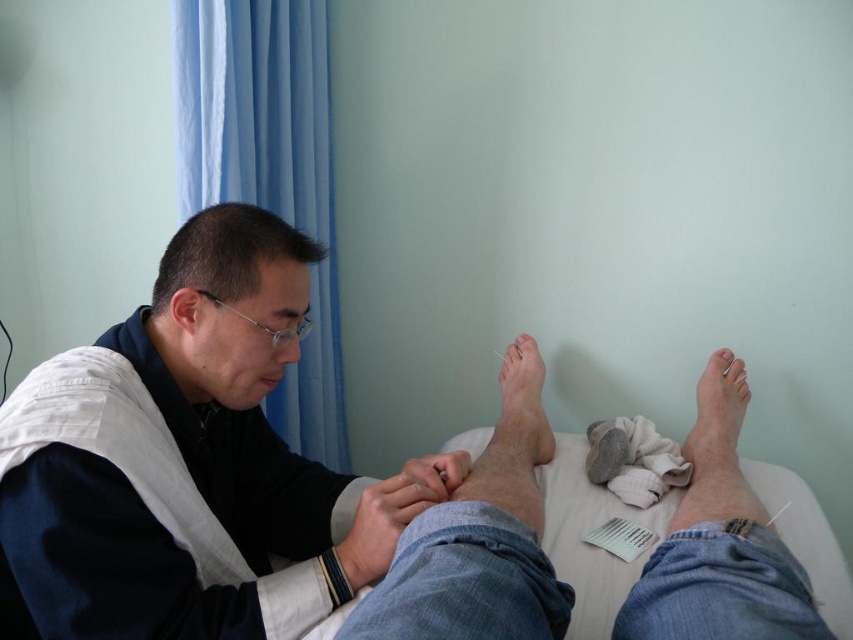
You are a patient in a medical room and see the matte black shirt at center and the white matte toe at center. Which object is closer to you?

A: The matte black shirt at center is closer to you because it is in front of the white matte toe at center.

You are a patient in a medical setting and see the point marked at coordinates (189, 464). What object is located at that point?

The point at (189, 464) marks the matte black shirt at center.

You are a healthcare professional entering the room and need to retrieve the gray fabric sock at lower right to give to the patient. The matte black shirt at center belongs to the acupuncturist currently performing the procedure. Can you safely reach the sock without disturbing the acupuncturist?

The matte black shirt at center and gray fabric sock at lower right are 29.61 inches apart, so yes, you can safely retrieve the gray fabric sock at lower right without disturbing the acupuncturist as there is sufficient distance between them.